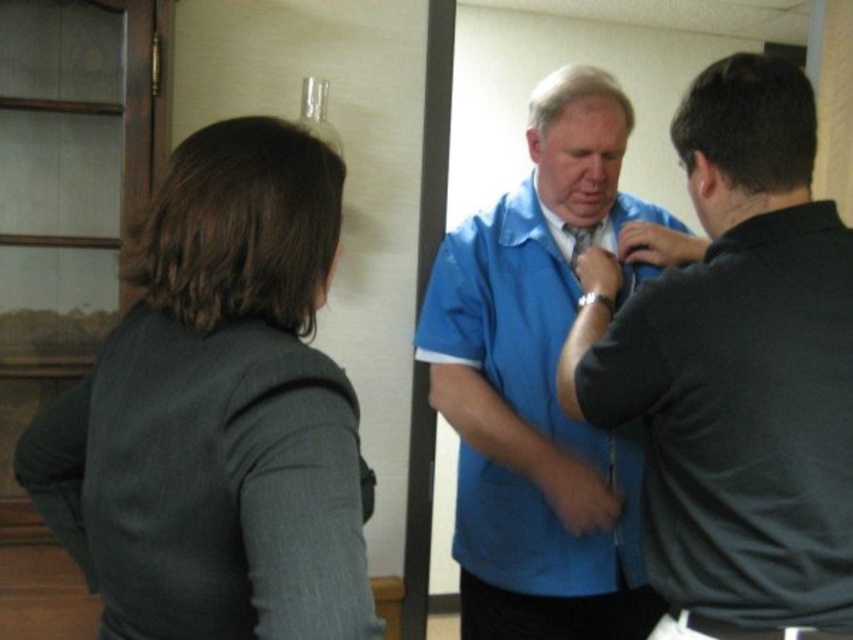
Question: Which point is farther from the camera taking this photo?

Choices:
 (A) (842, 380)
 (B) (579, 241)
 (C) (234, 182)
 (D) (556, 586)

Answer: (B)

Question: Does dark gray sweater at left appear on the right side of blue cotton shirt at center?

Choices:
 (A) yes
 (B) no

Answer: (B)

Question: Which object is farther from the camera taking this photo?

Choices:
 (A) dark gray sweater at left
 (B) matte blue tie at center
 (C) matte blue shirt at center
 (D) blue cotton shirt at center

Answer: (B)

Question: Considering the relative positions of matte blue shirt at center and matte blue tie at center in the image provided, where is matte blue shirt at center located with respect to matte blue tie at center?

Choices:
 (A) left
 (B) right

Answer: (B)

Question: Is matte blue shirt at center to the right of matte blue tie at center from the viewer's perspective?

Choices:
 (A) yes
 (B) no

Answer: (A)

Question: Which object is the closest to the matte blue shirt at center?

Choices:
 (A) blue cotton shirt at center
 (B) matte blue tie at center
 (C) dark gray sweater at left

Answer: (A)